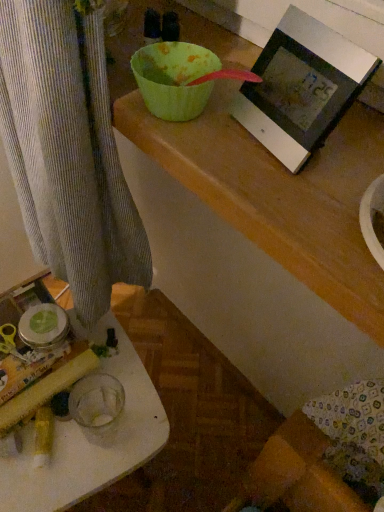
Question: Is white plastic table at lower left inside or outside of matte black picture frame at upper right?

Choices:
 (A) outside
 (B) inside

Answer: (A)

Question: From a real-world perspective, is white plastic table at lower left physically located above or below matte black picture frame at upper right?

Choices:
 (A) above
 (B) below

Answer: (B)

Question: Visually, is white plastic table at lower left positioned to the left or to the right of matte black picture frame at upper right?

Choices:
 (A) left
 (B) right

Answer: (A)

Question: Is matte black picture frame at upper right wider or thinner than white plastic table at lower left?

Choices:
 (A) wide
 (B) thin

Answer: (B)

Question: From the image's perspective, is matte black picture frame at upper right above or below white plastic table at lower left?

Choices:
 (A) below
 (B) above

Answer: (B)

Question: In terms of height, does matte black picture frame at upper right look taller or shorter compared to white plastic table at lower left?

Choices:
 (A) tall
 (B) short

Answer: (B)

Question: Looking at the image, does matte black picture frame at upper right seem bigger or smaller compared to white plastic table at lower left?

Choices:
 (A) big
 (B) small

Answer: (B)